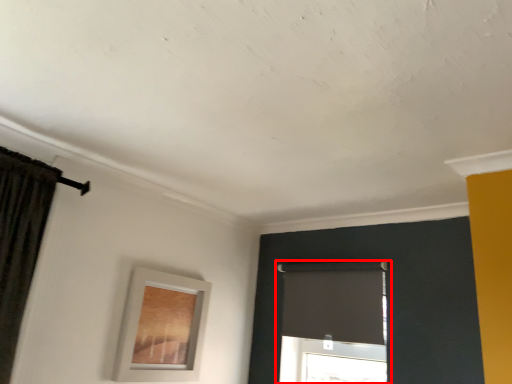
Question: In this image, where is window (annotated by the red box) located relative to picture frame?

Choices:
 (A) right
 (B) left

Answer: (A)